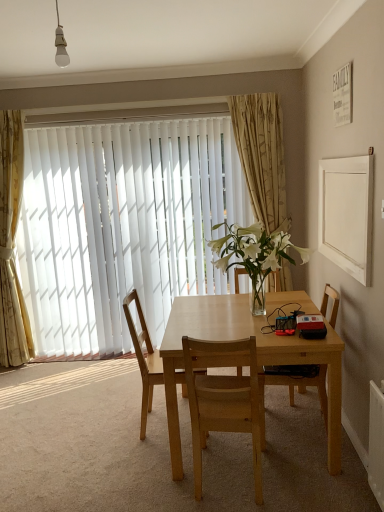
The image size is (384, 512). I want to click on free location to the right of light brown wood chair at center, the second chair from the left, so click(317, 489).